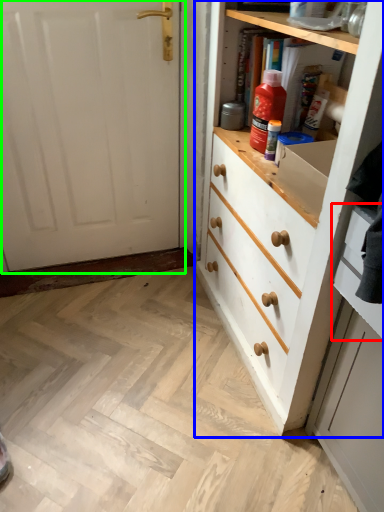
Question: Based on their relative distances, which object is farther from drawer (highlighted by a red box)? Choose from chest of drawers (highlighted by a blue box) and door (highlighted by a green box).

Choices:
 (A) chest of drawers
 (B) door

Answer: (B)